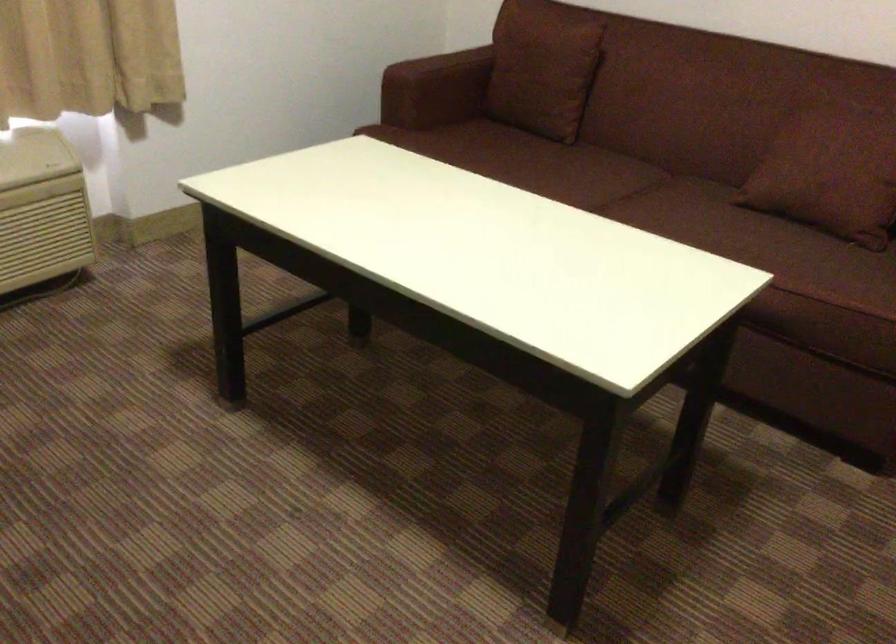
You are a GUI agent. You are given a task and a screenshot of the screen. Output one action in this format:
    pyautogui.click(x=<x>, y=<y>)
    Task: Click on the sofa armrest
    This screenshot has height=644, width=896.
    Given the screenshot: What is the action you would take?
    tap(441, 66)